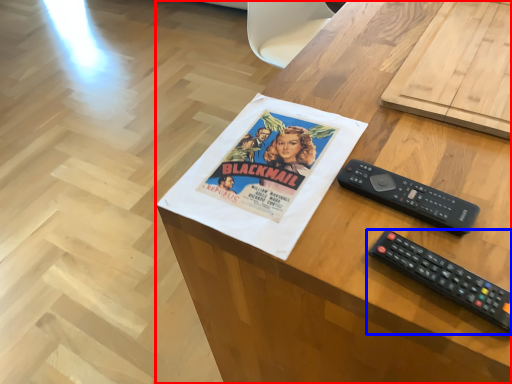
Question: Among these objects, which one is nearest to the camera, desk (highlighted by a red box) or remote control (highlighted by a blue box)?

Choices:
 (A) desk
 (B) remote control

Answer: (A)